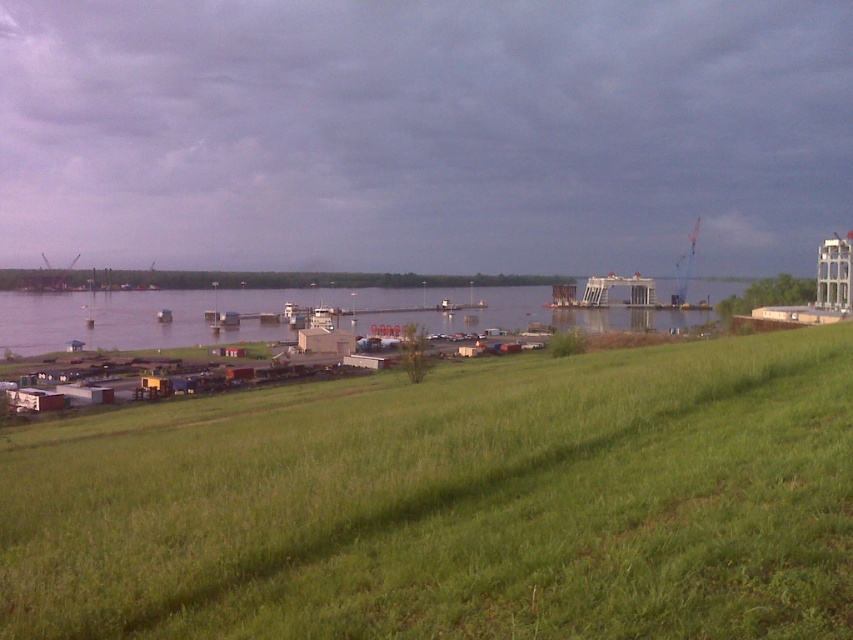
Is green grassy hillside at lower center smaller than clear water at center?

Indeed, green grassy hillside at lower center has a smaller size compared to clear water at center.

This screenshot has height=640, width=853. What do you see at coordinates (453, 502) in the screenshot?
I see `green grassy hillside at lower center` at bounding box center [453, 502].

The height and width of the screenshot is (640, 853). Identify the location of green grassy hillside at lower center. (453, 502).